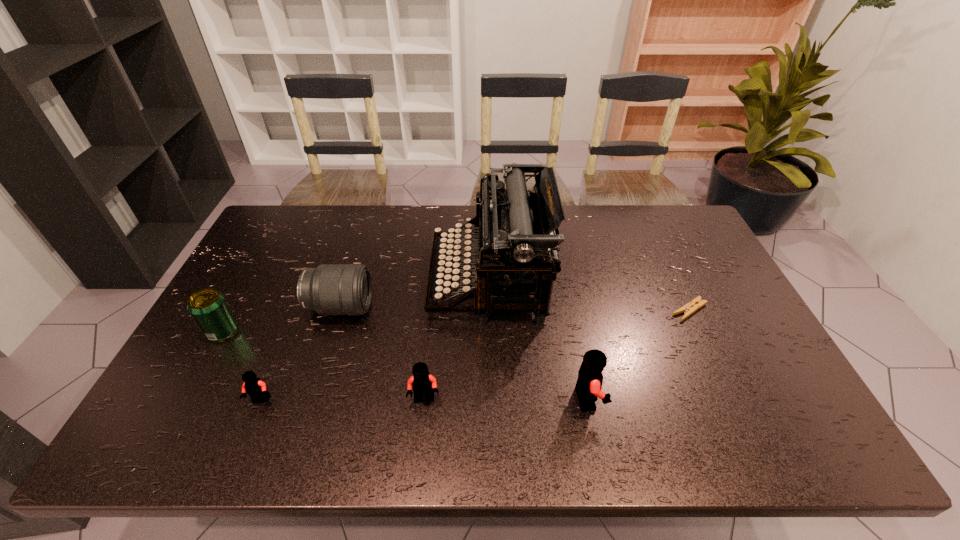
At what (x,y) coordinates should I click in order to perform the action: click on the shortest Lego. Please return your answer as a coordinate pair (x, y). Looking at the image, I should click on (254, 387).

At what (x,y) coordinates should I click in order to perform the action: click on the leftmost Lego. Please return your answer as a coordinate pair (x, y). This screenshot has height=540, width=960. Looking at the image, I should click on (254, 387).

Where is `the second shortest Lego`? The width and height of the screenshot is (960, 540). the second shortest Lego is located at coordinates (421, 382).

The image size is (960, 540). In order to click on the sixth object from left to right in this screenshot , I will do `click(588, 387)`.

This screenshot has height=540, width=960. Identify the location of the rightmost Lego. point(588,387).

Locate an element on the screen. The image size is (960, 540). typewriter is located at coordinates (512, 225).

This screenshot has width=960, height=540. I want to click on telephoto lens, so click(330, 289).

Locate an element on the screen. The width and height of the screenshot is (960, 540). the rightmost object is located at coordinates (691, 307).

Where is `clothespin`? Image resolution: width=960 pixels, height=540 pixels. clothespin is located at coordinates (691, 307).

You are a GUI agent. You are given a task and a screenshot of the screen. Output one action in this format:
    pyautogui.click(x=<x>, y=<y>)
    Task: Click on the beer can
    The image size is (960, 540).
    Given the screenshot: What is the action you would take?
    (x=208, y=307)